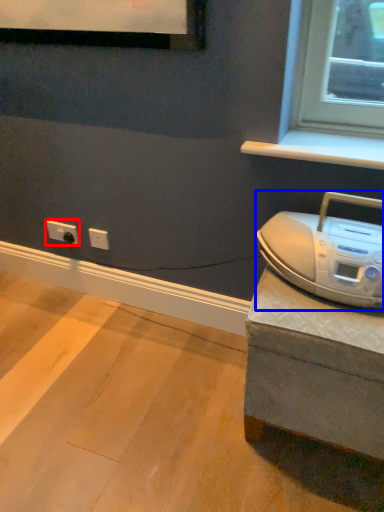
Question: Among these objects, which one is farthest to the camera, electric outlet (highlighted by a red box) or home appliance (highlighted by a blue box)?

Choices:
 (A) electric outlet
 (B) home appliance

Answer: (A)